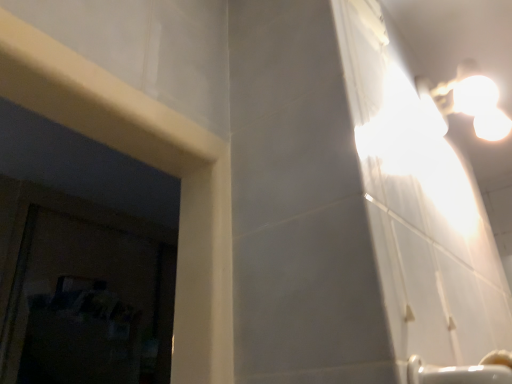
What do you see at coordinates (463, 371) in the screenshot? Image resolution: width=512 pixels, height=384 pixels. I see `white ceramic faucet at lower right` at bounding box center [463, 371].

Identify the location of white ceramic faucet at lower right. Image resolution: width=512 pixels, height=384 pixels. (463, 371).

Measure the distance between white glossy light fixture at upper right and camera.

white glossy light fixture at upper right and camera are 36.49 inches apart.

Measure the distance between point (436, 121) and camera.

Point (436, 121) and camera are 1.05 meters apart from each other.

What do you see at coordinates (465, 102) in the screenshot? I see `white glossy light fixture at upper right` at bounding box center [465, 102].

Where is `white glossy light fixture at upper right`? The width and height of the screenshot is (512, 384). white glossy light fixture at upper right is located at coordinates (465, 102).

What are the coordinates of `white ceramic faucet at lower right` in the screenshot? It's located at (463, 371).

Can you confirm if white ceramic faucet at lower right is positioned to the left of white glossy light fixture at upper right?

Indeed, white ceramic faucet at lower right is positioned on the left side of white glossy light fixture at upper right.

Looking at this image, in the image, is white ceramic faucet at lower right positioned in front of or behind white glossy light fixture at upper right?

white ceramic faucet at lower right is in front of white glossy light fixture at upper right.

Which is in front, point (475, 374) or point (441, 99)?

Point (475, 374)

From the image's perspective, which one is positioned higher, white ceramic faucet at lower right or white glossy light fixture at upper right?

white glossy light fixture at upper right appears higher in the image.

From a real-world perspective, between white ceramic faucet at lower right and white glossy light fixture at upper right, who is vertically lower?

From a 3D spatial view, white ceramic faucet at lower right is below.

Is white ceramic faucet at lower right thinner than white glossy light fixture at upper right?

Correct, the width of white ceramic faucet at lower right is less than that of white glossy light fixture at upper right.

Can you confirm if white ceramic faucet at lower right is taller than white glossy light fixture at upper right?

No.

Considering the sizes of objects white ceramic faucet at lower right and white glossy light fixture at upper right in the image provided, who is smaller, white ceramic faucet at lower right or white glossy light fixture at upper right?

With smaller size is white ceramic faucet at lower right.

Can white glossy light fixture at upper right be found inside white ceramic faucet at lower right?

That's incorrect, white glossy light fixture at upper right is not inside white ceramic faucet at lower right.

Does white ceramic faucet at lower right touch white glossy light fixture at upper right?

No, white ceramic faucet at lower right is not with white glossy light fixture at upper right.

Is white ceramic faucet at lower right facing away from white glossy light fixture at upper right?

white ceramic faucet at lower right does not have its back to white glossy light fixture at upper right.

You are a GUI agent. You are given a task and a screenshot of the screen. Output one action in this format:
    pyautogui.click(x=<x>, y=<y>)
    Task: Click on the faucet on the left of white glossy light fixture at upper right
    
    Given the screenshot: What is the action you would take?
    pyautogui.click(x=463, y=371)

Between white glossy light fixture at upper right and white ceramic faucet at lower right, which one appears on the right side from the viewer's perspective?

Positioned to the right is white glossy light fixture at upper right.

In the scene shown: Which object is closer to the camera taking this photo, white glossy light fixture at upper right or white ceramic faucet at lower right?

white ceramic faucet at lower right is in front.

Consider the image. Which is less distant, [432,110] or [487,382]?

Point [432,110] is farther from the camera than point [487,382].

From the image's perspective, which one is positioned higher, white glossy light fixture at upper right or white ceramic faucet at lower right?

white glossy light fixture at upper right is shown above in the image.

From a real-world perspective, is white glossy light fixture at upper right above or below white ceramic faucet at lower right?

In terms of real-world spatial position, white glossy light fixture at upper right is above white ceramic faucet at lower right.

Considering the relative sizes of white glossy light fixture at upper right and white ceramic faucet at lower right in the image provided, is white glossy light fixture at upper right wider than white ceramic faucet at lower right?

Correct, the width of white glossy light fixture at upper right exceeds that of white ceramic faucet at lower right.

Is white glossy light fixture at upper right taller than white ceramic faucet at lower right?

Indeed, white glossy light fixture at upper right has a greater height compared to white ceramic faucet at lower right.

Which of these two, white glossy light fixture at upper right or white ceramic faucet at lower right, is bigger?

Bigger between the two is white glossy light fixture at upper right.

Does white glossy light fixture at upper right contain white ceramic faucet at lower right?

No, white ceramic faucet at lower right is not a part of white glossy light fixture at upper right.

In the scene shown: Is white glossy light fixture at upper right in contact with white ceramic faucet at lower right?

white glossy light fixture at upper right and white ceramic faucet at lower right are not in contact.

Is white glossy light fixture at upper right positioned with its back to white ceramic faucet at lower right?

That's not correct — white glossy light fixture at upper right is not looking away from white ceramic faucet at lower right.

The width and height of the screenshot is (512, 384). I want to click on light fixture above the white ceramic faucet at lower right (from the image's perspective), so click(465, 102).

Identify the location of faucet in front of the white glossy light fixture at upper right. This screenshot has width=512, height=384. (463, 371).

Where is `light fixture above the white ceramic faucet at lower right (from the image's perspective)`? Image resolution: width=512 pixels, height=384 pixels. light fixture above the white ceramic faucet at lower right (from the image's perspective) is located at coordinates (465, 102).